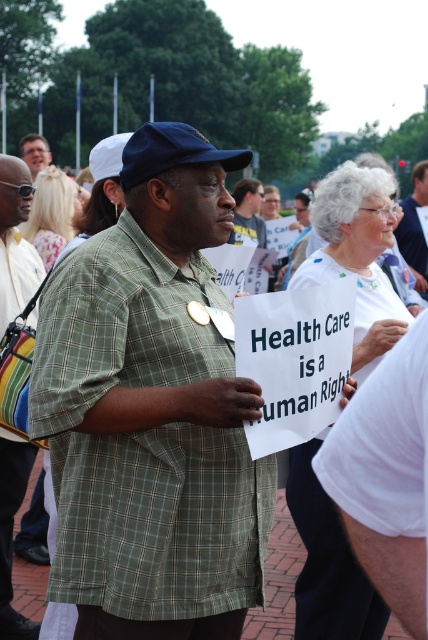
Question: Which object is positioned closest to the multicolored striped bag at left?

Choices:
 (A) green plaid shirt at center
 (B) matte black sign at center

Answer: (B)

Question: Can you confirm if green plaid shirt at center is positioned to the right of matte black sign at center?

Choices:
 (A) no
 (B) yes

Answer: (B)

Question: Considering the relative positions of multicolored striped bag at left and matte black sign at center in the image provided, where is multicolored striped bag at left located with respect to matte black sign at center?

Choices:
 (A) above
 (B) below

Answer: (B)

Question: Which point is closer to the camera?

Choices:
 (A) multicolored striped bag at left
 (B) green plaid shirt at center

Answer: (A)

Question: Is multicolored striped bag at left bigger than matte black sign at center?

Choices:
 (A) yes
 (B) no

Answer: (B)

Question: Among these objects, which one is nearest to the camera?

Choices:
 (A) green plaid shirt at center
 (B) matte black sign at center
 (C) multicolored striped bag at left

Answer: (C)